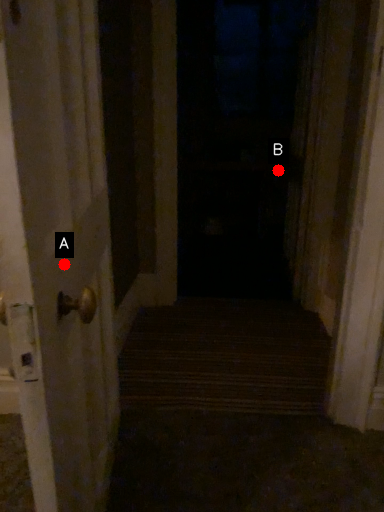
Question: Two points are circled on the image, labeled by A and B beside each circle. Which point is farther from the camera taking this photo?

Choices:
 (A) A is further
 (B) B is further

Answer: (B)